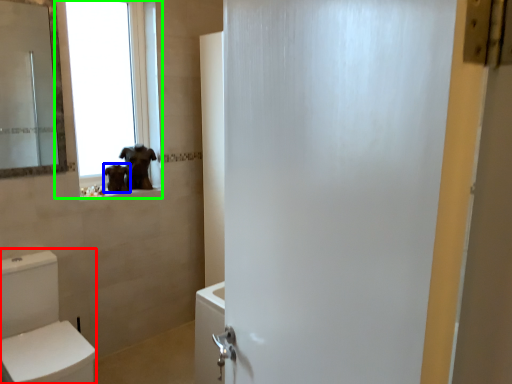
Question: Which is nearer to the toilet bowl (highlighted by a red box)? animal (highlighted by a blue box) or window (highlighted by a green box).

Choices:
 (A) animal
 (B) window

Answer: (A)